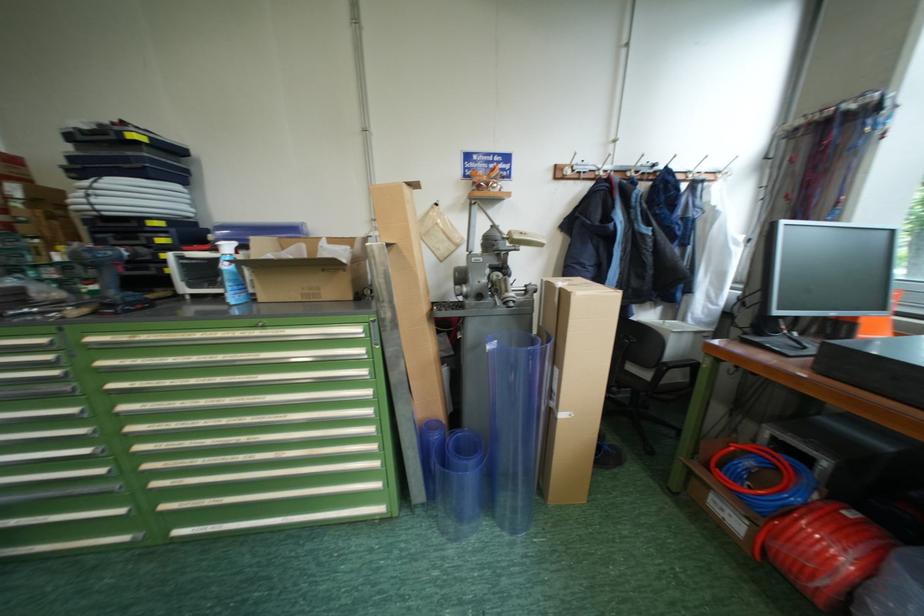
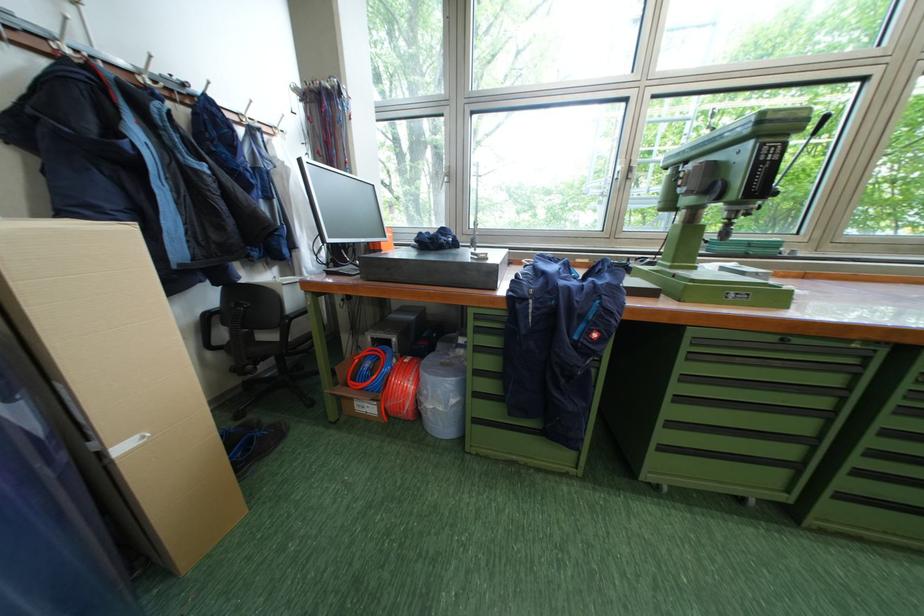
Question: How did the camera likely rotate?

Choices:
 (A) Left
 (B) Right
 (C) Up
 (D) Down

Answer: (B)